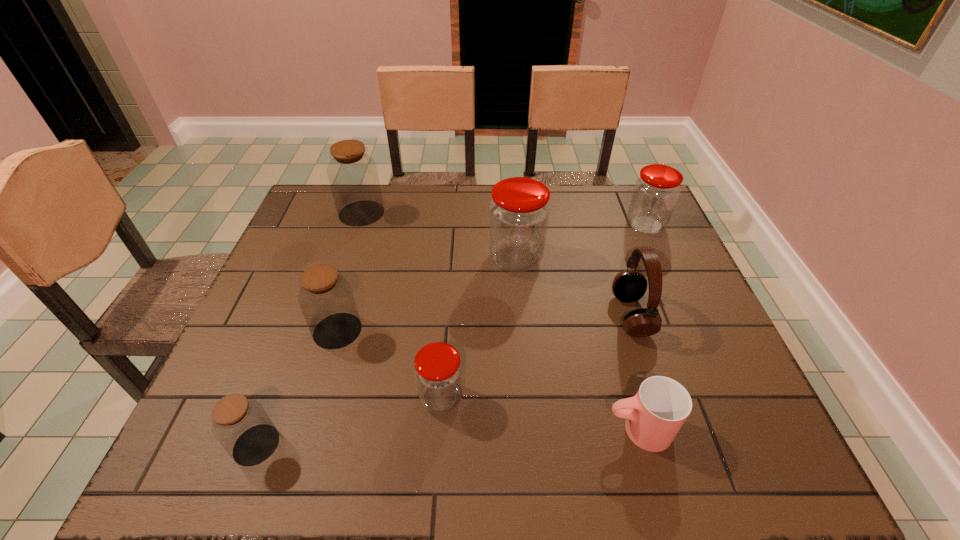
Locate an element on the screen. empty space between the nearest jar and the second farthest brown jar is located at coordinates 297,388.

The height and width of the screenshot is (540, 960). In order to click on free space between the nearest brown jar and the fifth jar from left to right in this screenshot , I will do tap(386, 352).

Locate an element on the screen. vacant space that's between the headset and the second smallest brown jar is located at coordinates (485, 323).

This screenshot has height=540, width=960. What are the coordinates of `free space between the farthest brown jar and the second nearest brown jar` in the screenshot? It's located at (349, 272).

Select which object appears as the fifth closest to the farthest red jar. Please provide its 2D coordinates. Your answer should be formatted as a tuple, i.e. [(x, y)], where the tuple contains the x and y coordinates of a point satisfying the conditions above.

[(353, 176)]

Identify which object is located as the sixth nearest to the smallest brown jar. Please provide its 2D coordinates. Your answer should be formatted as a tuple, i.e. [(x, y)], where the tuple contains the x and y coordinates of a point satisfying the conditions above.

[(628, 286)]

Where is `jar that is the second closest to the biggest red jar`? This screenshot has width=960, height=540. jar that is the second closest to the biggest red jar is located at coordinates (438, 372).

Identify which jar is the fourth nearest to the nearest brown jar. Please provide its 2D coordinates. Your answer should be formatted as a tuple, i.e. [(x, y)], where the tuple contains the x and y coordinates of a point satisfying the conditions above.

[(353, 176)]

Choose which brown jar is the second nearest neighbor to the biggest brown jar. Please provide its 2D coordinates. Your answer should be formatted as a tuple, i.e. [(x, y)], where the tuple contains the x and y coordinates of a point satisfying the conditions above.

[(240, 424)]

Locate which brown jar is the second closest to the fifth farthest jar. Please provide its 2D coordinates. Your answer should be formatted as a tuple, i.e. [(x, y)], where the tuple contains the x and y coordinates of a point satisfying the conditions above.

[(240, 424)]